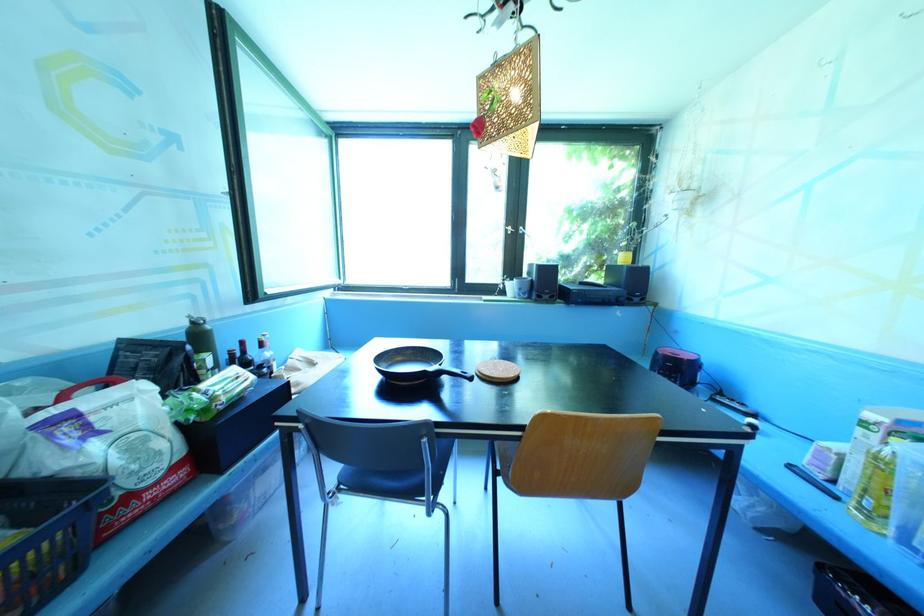
What do you see at coordinates (521, 286) in the screenshot? I see `the grey ceramic mug` at bounding box center [521, 286].